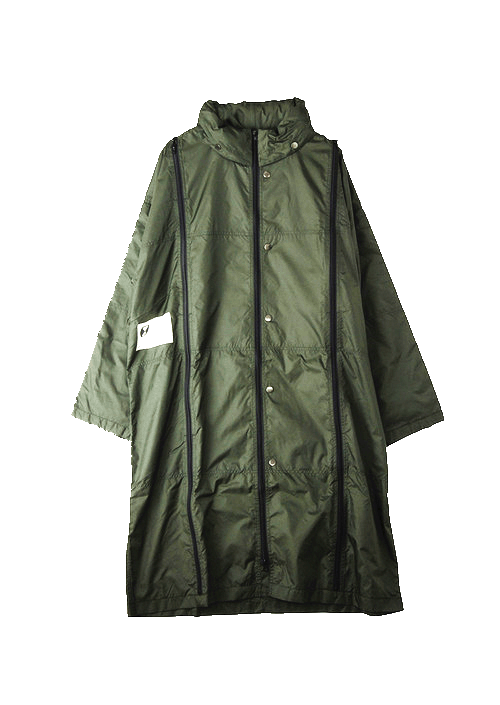
Where is `rectangular pieces of fabric`? rectangular pieces of fabric is located at coordinates (224, 209), (224, 557), (233, 443), (288, 550), (295, 391), (303, 302), (303, 204), (225, 287).